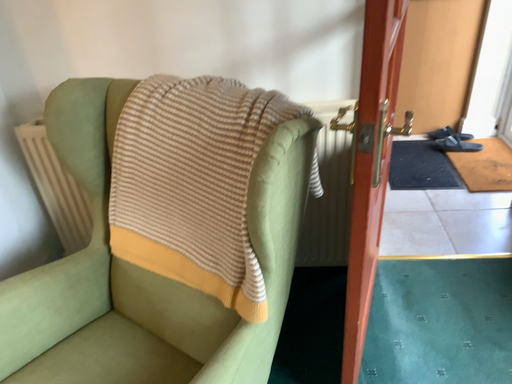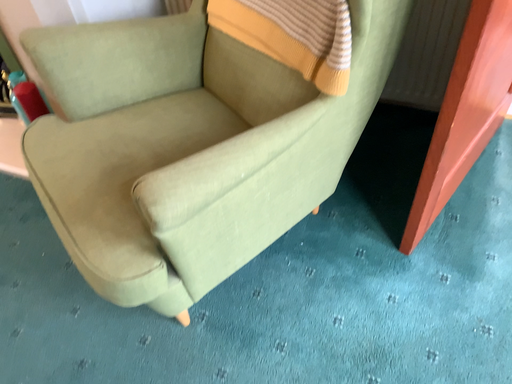
Question: How did the camera likely rotate when shooting the video?

Choices:
 (A) rotated left
 (B) rotated right

Answer: (A)